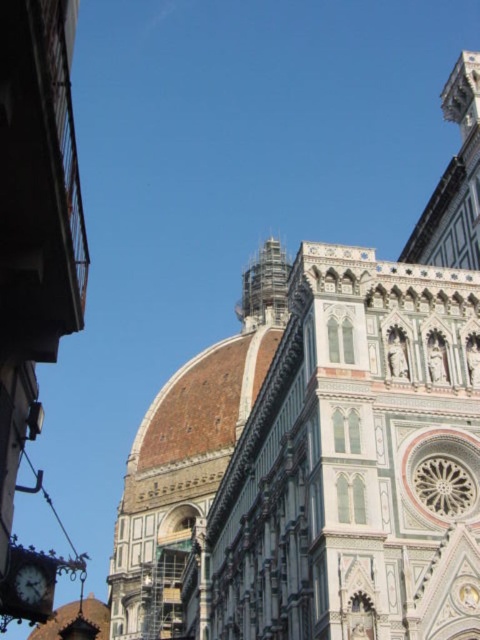
You are standing in front of the Florence Cathedral and want to take a photo that includes both the brown tiled dome at center and the matte black clock at lower left. Based on their positions, which object should you position at the top of your camera frame to ensure both are visible?

The brown tiled dome at center is located above the matte black clock at lower left, so you should position the brown tiled dome at center at the top of your camera frame to include both in the photo.

You are an architect visiting Florence Cathedral and want to compare the sizes of the brown tiled dome at center and the matte black clock at lower left. Based on the scene, which object is bigger?

The brown tiled dome at center has a larger size compared to the matte black clock at lower left, so the brown tiled dome at center is bigger.

You are standing in front of the Florence Cathedral and want to take a photo of the iconic dome and the ornate facade. The point you are currently at is point (269, 358). Considering the distance between you and this point, will you be able to capture both the dome and the facade in a single frame without moving?

The distance between point (269, 358) and the viewer is 395.58 feet. Since this distance is quite large, it is possible to capture both the dome and the facade in a single frame without moving, as the viewpoint is far enough to encompass both structures in the composition.